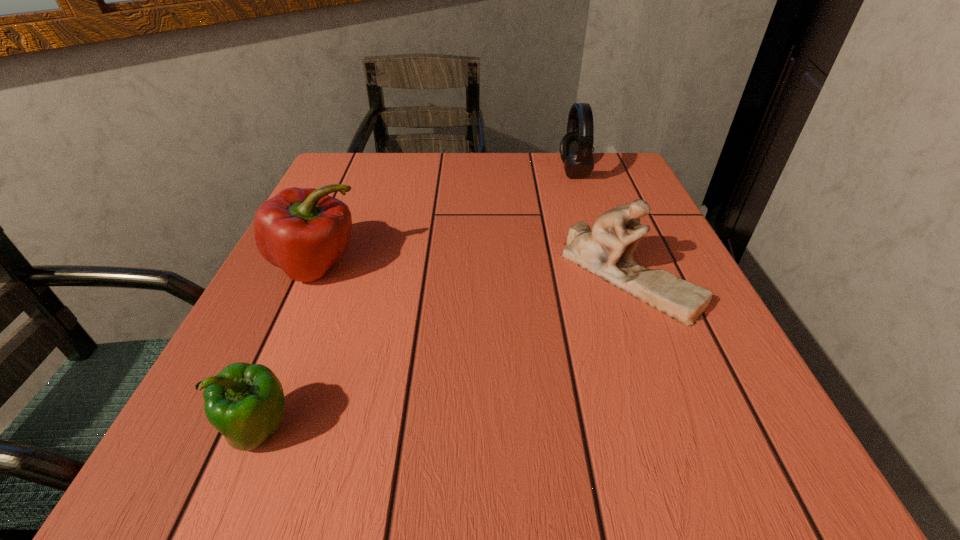
The width and height of the screenshot is (960, 540). I want to click on free space at the right edge of the desktop, so click(x=688, y=330).

Identify the location of vacant region at the far left corner of the desktop. 375,157.

In the image, there is a desktop. Where is `vacant space at the far right corner`? The image size is (960, 540). vacant space at the far right corner is located at coordinates (631, 165).

Locate an element on the screen. The image size is (960, 540). empty location between the figurine and the shorter bell pepper is located at coordinates tap(445, 353).

Where is `vacant area between the nearer bell pepper and the farther bell pepper`? The height and width of the screenshot is (540, 960). vacant area between the nearer bell pepper and the farther bell pepper is located at coordinates (290, 348).

You are a GUI agent. You are given a task and a screenshot of the screen. Output one action in this format:
    pyautogui.click(x=<x>, y=<y>)
    Task: Click on the free point between the farther bell pepper and the figurine
    This screenshot has height=540, width=960.
    Given the screenshot: What is the action you would take?
    pyautogui.click(x=473, y=271)

The height and width of the screenshot is (540, 960). I want to click on free space between the farthest object and the nearer bell pepper, so click(418, 301).

Where is `vacant point located between the figurine and the farther bell pepper`? This screenshot has width=960, height=540. vacant point located between the figurine and the farther bell pepper is located at coordinates (473, 271).

Identify the location of free spot between the figurine and the farther bell pepper. (473, 271).

The height and width of the screenshot is (540, 960). Identify the location of free area in between the shorter bell pepper and the headset. (418, 301).